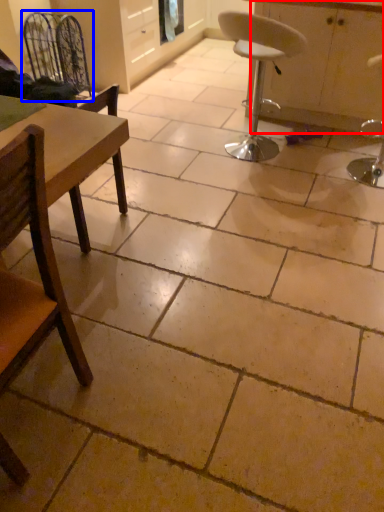
Question: Which object is closer to the camera taking this photo, cabinetry (highlighted by a red box) or swivel chair (highlighted by a blue box)?

Choices:
 (A) cabinetry
 (B) swivel chair

Answer: (A)